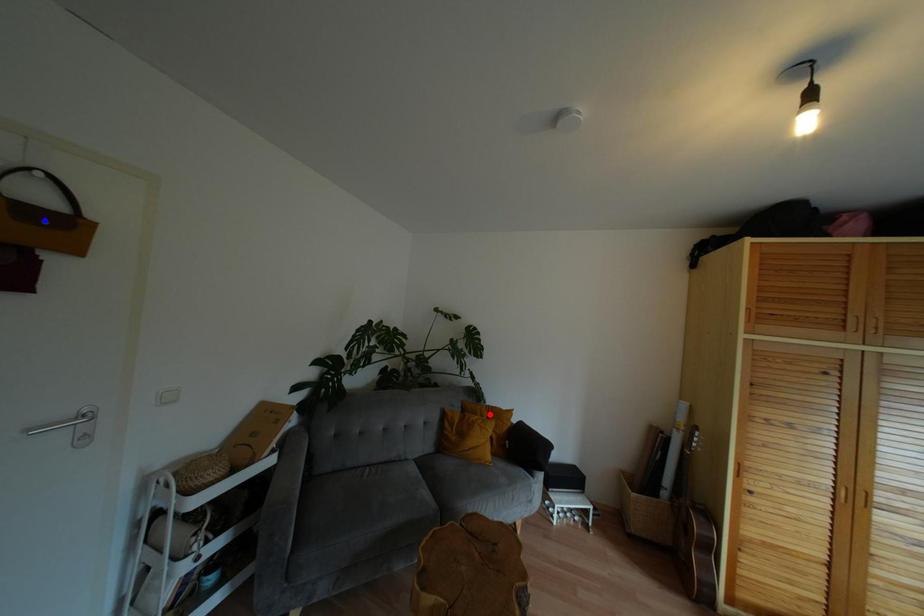
Question: Which of the two points in the image is closer to the camera?

Choices:
 (A) Blue point is closer.
 (B) Red point is closer.

Answer: (A)